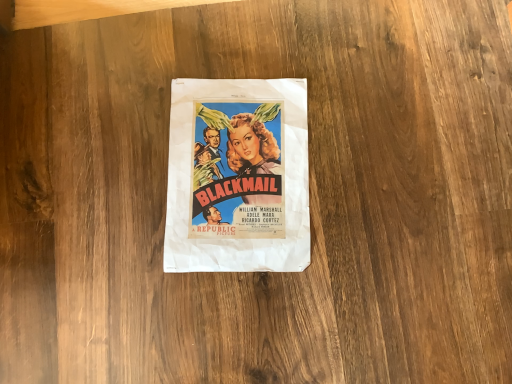
Find the location of `free location above matte paper poster at center (from a real-world perspective)`. free location above matte paper poster at center (from a real-world perspective) is located at coordinates (243, 173).